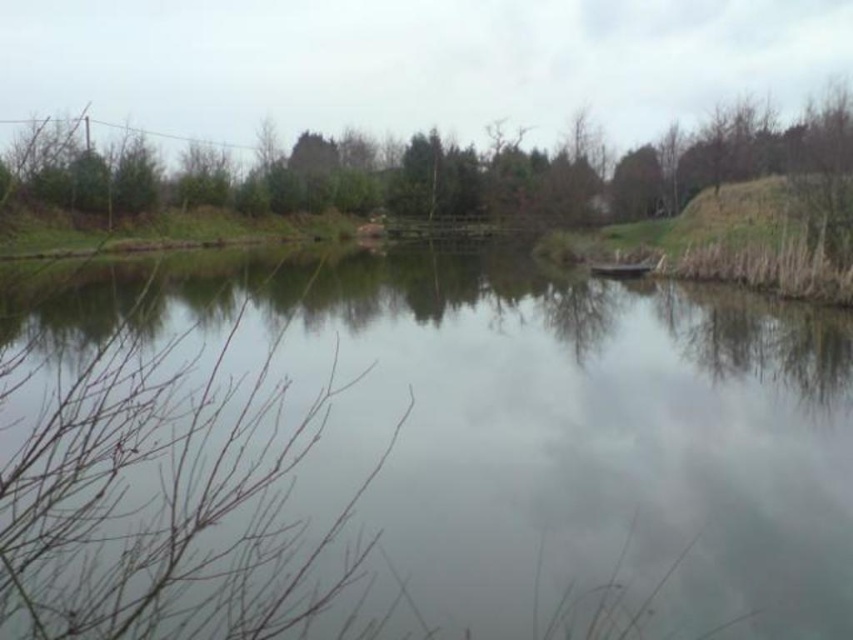
Question: Which point appears closest to the camera in this image?

Choices:
 (A) (491, 529)
 (B) (643, 161)

Answer: (A)

Question: Can you confirm if transparent water at center is bigger than green leafy tree at upper center?

Choices:
 (A) no
 (B) yes

Answer: (A)

Question: Which point appears closest to the camera in this image?

Choices:
 (A) (248, 193)
 (B) (456, 307)

Answer: (B)

Question: Can you confirm if transparent water at center is wider than green leafy tree at upper center?

Choices:
 (A) no
 (B) yes

Answer: (A)

Question: Can you confirm if transparent water at center is bigger than green leafy tree at upper center?

Choices:
 (A) yes
 (B) no

Answer: (B)

Question: Which point is farther to the camera?

Choices:
 (A) green leafy tree at upper center
 (B) transparent water at center

Answer: (A)